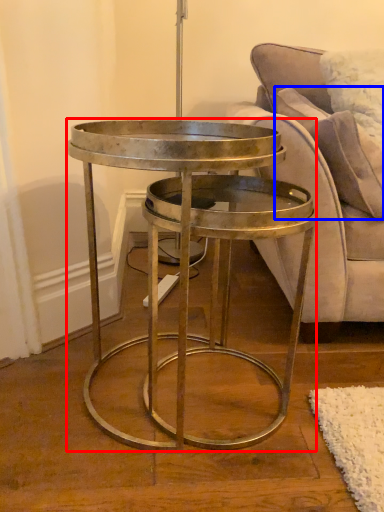
Question: Among these objects, which one is nearest to the camera, coffee table (highlighted by a red box) or pillow (highlighted by a blue box)?

Choices:
 (A) coffee table
 (B) pillow

Answer: (A)